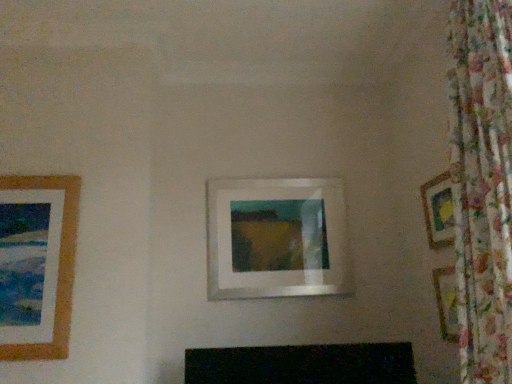
The image size is (512, 384). I want to click on white matte picture frame at center, which appears as the second picture frame when viewed from the left, so click(279, 240).

Is wooden picture frame at right, which appears as the first picture frame when viewed from the right, not close to white matte picture frame at center, the 2th picture frame viewed from the right?

wooden picture frame at right, which appears as the first picture frame when viewed from the right, is near white matte picture frame at center, the 2th picture frame viewed from the right, not far away.

Can you confirm if wooden picture frame at right, which ranks as the third picture frame in left-to-right order, is smaller than white matte picture frame at center, which appears as the second picture frame when viewed from the left?

Yes.

Considering the relative sizes of wooden picture frame at right, which ranks as the third picture frame in left-to-right order, and white matte picture frame at center, which appears as the second picture frame when viewed from the left, in the image provided, is wooden picture frame at right, which ranks as the third picture frame in left-to-right order, thinner than white matte picture frame at center, which appears as the second picture frame when viewed from the left,?

Yes.

From a real-world perspective, between wooden picture frame at right, which ranks as the third picture frame in left-to-right order, and white matte picture frame at center, the 2th picture frame viewed from the right, who is vertically higher?

wooden picture frame at right, which ranks as the third picture frame in left-to-right order, from a real-world perspective.

How much distance is there between brown wooden picture frame at left, which is the first picture frame from left to right, and wooden picture frame at right, which appears as the first picture frame when viewed from the right?

The distance of brown wooden picture frame at left, which is the first picture frame from left to right, from wooden picture frame at right, which appears as the first picture frame when viewed from the right, is 6.31 feet.

Considering the relative sizes of brown wooden picture frame at left, which is the third picture frame in right-to-left order, and wooden picture frame at right, which ranks as the third picture frame in left-to-right order, in the image provided, is brown wooden picture frame at left, which is the third picture frame in right-to-left order, taller than wooden picture frame at right, which ranks as the third picture frame in left-to-right order,?

Yes.

Which object is closer to the camera, brown wooden picture frame at left, which is the third picture frame in right-to-left order, or wooden picture frame at right, which appears as the first picture frame when viewed from the right?

brown wooden picture frame at left, which is the third picture frame in right-to-left order, is in front.

Is wooden picture frame at right, which ranks as the third picture frame in left-to-right order, at the back of brown wooden picture frame at left, which is the third picture frame in right-to-left order?

No, wooden picture frame at right, which ranks as the third picture frame in left-to-right order, is not at the back of brown wooden picture frame at left, which is the third picture frame in right-to-left order.

Consider the image. Considering their positions, is brown wooden picture frame at left, which is the third picture frame in right-to-left order, located in front of or behind white matte picture frame at center, the 2th picture frame viewed from the right?

Clearly, brown wooden picture frame at left, which is the third picture frame in right-to-left order, is in front of white matte picture frame at center, the 2th picture frame viewed from the right.

Consider the image. Between brown wooden picture frame at left, which is the third picture frame in right-to-left order, and white matte picture frame at center, the 2th picture frame viewed from the right, which one has less height?

white matte picture frame at center, the 2th picture frame viewed from the right.

Is point (71, 185) more distant than point (223, 280)?

No, it is in front of (223, 280).

This screenshot has width=512, height=384. Find the location of `the 2nd picture frame to the right of the brown wooden picture frame at left, which is the third picture frame in right-to-left order, starting your count from the anchor`. the 2nd picture frame to the right of the brown wooden picture frame at left, which is the third picture frame in right-to-left order, starting your count from the anchor is located at coordinates (438, 210).

From a real-world perspective, is wooden picture frame at right, which appears as the first picture frame when viewed from the right, above or below brown wooden picture frame at left, which is the third picture frame in right-to-left order?

wooden picture frame at right, which appears as the first picture frame when viewed from the right, is above brown wooden picture frame at left, which is the third picture frame in right-to-left order.

Considering the points (435, 209) and (63, 291), which point is behind, point (435, 209) or point (63, 291)?

The point (435, 209) is farther.

Can you confirm if wooden picture frame at right, which appears as the first picture frame when viewed from the right, is thinner than brown wooden picture frame at left, which is the third picture frame in right-to-left order?

Indeed, wooden picture frame at right, which appears as the first picture frame when viewed from the right, has a lesser width compared to brown wooden picture frame at left, which is the third picture frame in right-to-left order.

Does white matte picture frame at center, the 2th picture frame viewed from the right, have a greater width compared to brown wooden picture frame at left, which is the third picture frame in right-to-left order?

Indeed, white matte picture frame at center, the 2th picture frame viewed from the right, has a greater width compared to brown wooden picture frame at left, which is the third picture frame in right-to-left order.

Is white matte picture frame at center, the 2th picture frame viewed from the right, beside brown wooden picture frame at left, which is the third picture frame in right-to-left order?

No, white matte picture frame at center, the 2th picture frame viewed from the right, is not with brown wooden picture frame at left, which is the third picture frame in right-to-left order.

Is point (319, 285) positioned after point (67, 250)?

Yes, it is.

Between white matte picture frame at center, which appears as the second picture frame when viewed from the left, and wooden picture frame at right, which appears as the first picture frame when viewed from the right, which one is positioned in front?

Positioned in front is wooden picture frame at right, which appears as the first picture frame when viewed from the right.

How many degrees apart are the facing directions of white matte picture frame at center, the 2th picture frame viewed from the right, and wooden picture frame at right, which appears as the first picture frame when viewed from the right?

The angle between the facing direction of white matte picture frame at center, the 2th picture frame viewed from the right, and the facing direction of wooden picture frame at right, which appears as the first picture frame when viewed from the right, is 90.1 degrees.

Is wooden picture frame at right, which ranks as the third picture frame in left-to-right order, at the back of white matte picture frame at center, the 2th picture frame viewed from the right?

No, wooden picture frame at right, which ranks as the third picture frame in left-to-right order, is not at the back of white matte picture frame at center, the 2th picture frame viewed from the right.

From a real-world perspective, is white matte picture frame at center, which appears as the second picture frame when viewed from the left, above or below wooden picture frame at right, which appears as the first picture frame when viewed from the right?

Clearly, from a real-world perspective, white matte picture frame at center, which appears as the second picture frame when viewed from the left, is below wooden picture frame at right, which appears as the first picture frame when viewed from the right.

The height and width of the screenshot is (384, 512). Find the location of `the 1st picture frame to the left of the wooden picture frame at right, which ranks as the third picture frame in left-to-right order, counting from the anchor's position`. the 1st picture frame to the left of the wooden picture frame at right, which ranks as the third picture frame in left-to-right order, counting from the anchor's position is located at coordinates (279, 240).

Image resolution: width=512 pixels, height=384 pixels. Identify the location of the 2nd picture frame to the right of the brown wooden picture frame at left, which is the first picture frame from left to right, starting your count from the anchor. (438, 210).

Based on their spatial positions, is white matte picture frame at center, the 2th picture frame viewed from the right, or brown wooden picture frame at left, which is the first picture frame from left to right, further from wooden picture frame at right, which ranks as the third picture frame in left-to-right order?

Based on the image, brown wooden picture frame at left, which is the first picture frame from left to right, appears to be further to wooden picture frame at right, which ranks as the third picture frame in left-to-right order.

Looking at the image, which one is located further to white matte picture frame at center, the 2th picture frame viewed from the right, brown wooden picture frame at left, which is the third picture frame in right-to-left order, or wooden picture frame at right, which ranks as the third picture frame in left-to-right order?

brown wooden picture frame at left, which is the third picture frame in right-to-left order, is further to white matte picture frame at center, the 2th picture frame viewed from the right.

From the image, which object appears to be nearer to brown wooden picture frame at left, which is the first picture frame from left to right, wooden picture frame at right, which ranks as the third picture frame in left-to-right order, or white matte picture frame at center, the 2th picture frame viewed from the right?

white matte picture frame at center, the 2th picture frame viewed from the right, lies closer to brown wooden picture frame at left, which is the first picture frame from left to right, than the other object.

From the image, which object appears to be nearer to wooden picture frame at right, which ranks as the third picture frame in left-to-right order, brown wooden picture frame at left, which is the third picture frame in right-to-left order, or white matte picture frame at center, the 2th picture frame viewed from the right?

Based on the image, white matte picture frame at center, the 2th picture frame viewed from the right, appears to be nearer to wooden picture frame at right, which ranks as the third picture frame in left-to-right order.

Estimate the real-world distances between objects in this image. Which object is closer to brown wooden picture frame at left, which is the first picture frame from left to right, white matte picture frame at center, the 2th picture frame viewed from the right, or wooden picture frame at right, which appears as the first picture frame when viewed from the right?

The object closer to brown wooden picture frame at left, which is the first picture frame from left to right, is white matte picture frame at center, the 2th picture frame viewed from the right.

When comparing their distances from white matte picture frame at center, the 2th picture frame viewed from the right, does wooden picture frame at right, which ranks as the third picture frame in left-to-right order, or brown wooden picture frame at left, which is the third picture frame in right-to-left order, seem further?

brown wooden picture frame at left, which is the third picture frame in right-to-left order, is positioned further to the anchor white matte picture frame at center, the 2th picture frame viewed from the right.

Locate an element on the screen. Image resolution: width=512 pixels, height=384 pixels. picture frame between brown wooden picture frame at left, which is the first picture frame from left to right, and wooden picture frame at right, which appears as the first picture frame when viewed from the right, in the horizontal direction is located at coordinates (279, 240).